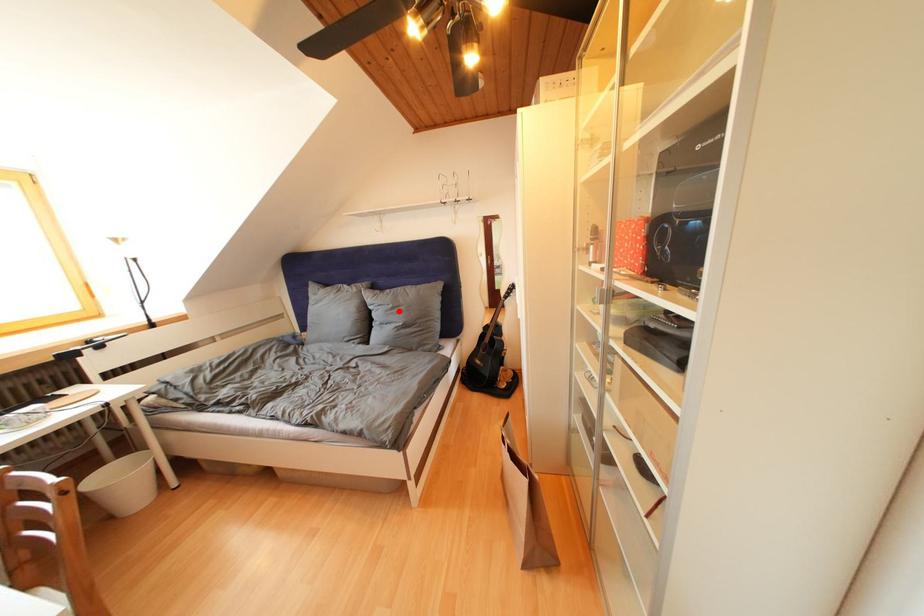
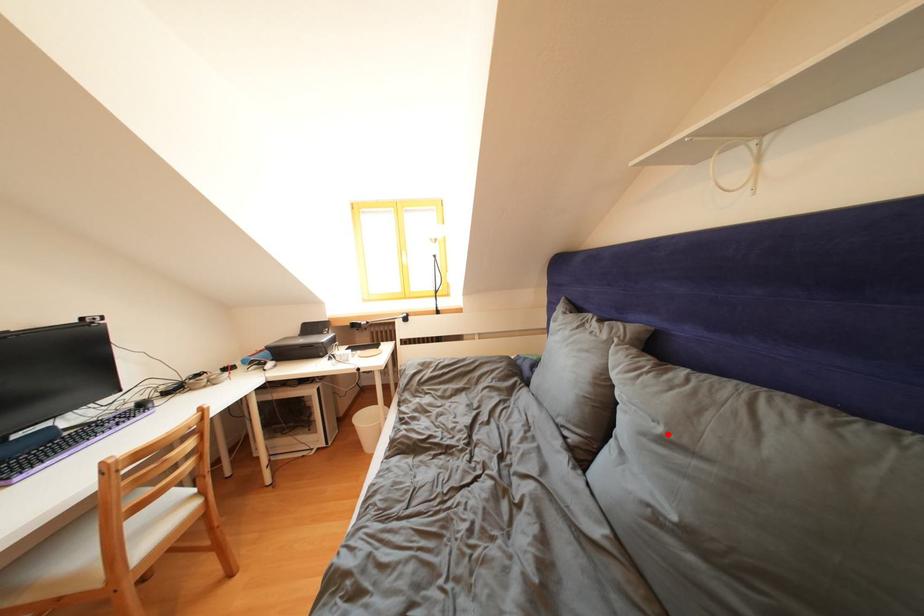
I am providing you with two images of the same scene from different viewpoints. A red point is marked on the first image and another point is marked on the second image. Is the red point in image1 aligned with the point shown in image2?

Yes